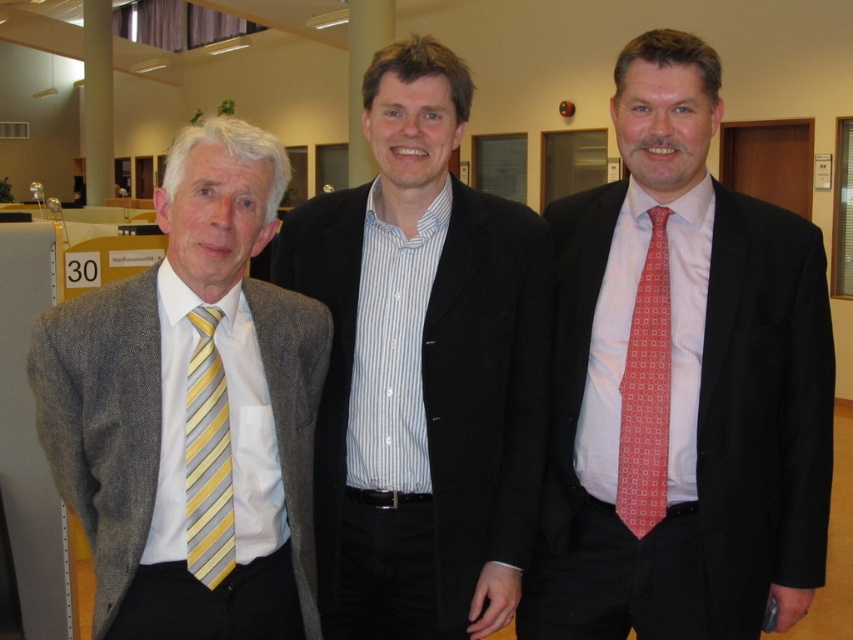
Does matte black suit at center have a lesser height compared to yellow striped tie at left?

No, matte black suit at center is not shorter than yellow striped tie at left.

Is matte black suit at center taller than yellow striped tie at left?

Correct, matte black suit at center is much taller as yellow striped tie at left.

Is point (630, 406) positioned behind point (209, 355)?

Yes, it is.

You are a GUI agent. You are given a task and a screenshot of the screen. Output one action in this format:
    pyautogui.click(x=<x>, y=<y>)
    Task: Click on the matte black suit at center
    
    Given the screenshot: What is the action you would take?
    [x=682, y=385]

Is white striped shirt at center positioned in front of red silk tie at right?

Yes.

Is white striped shirt at center thinner than red silk tie at right?

No, white striped shirt at center is not thinner than red silk tie at right.

This screenshot has width=853, height=640. Find the location of `white striped shirt at center`. white striped shirt at center is located at coordinates (422, 369).

Find the location of a particular element. Image resolution: width=853 pixels, height=640 pixels. white striped shirt at center is located at coordinates (422, 369).

Consider the image. Which is below, gray herringbone blazer at left or red silk tie at right?

gray herringbone blazer at left is lower down.

Can you confirm if gray herringbone blazer at left is smaller than red silk tie at right?

Incorrect, gray herringbone blazer at left is not smaller in size than red silk tie at right.

Does point (71, 492) lie in front of point (659, 454)?

Yes, it is.

The width and height of the screenshot is (853, 640). I want to click on gray herringbone blazer at left, so click(x=192, y=412).